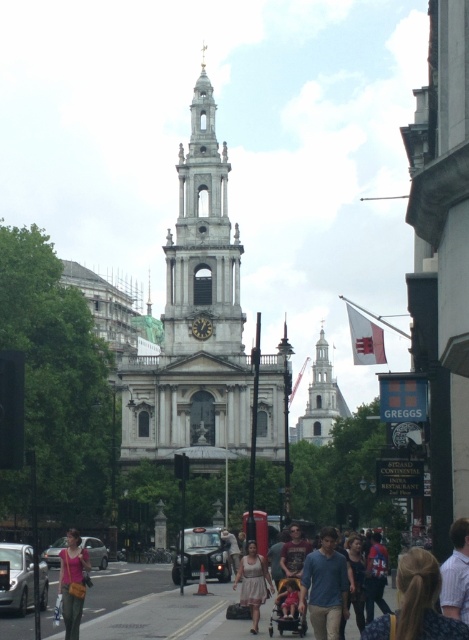
Locate an element on the screen. The height and width of the screenshot is (640, 469). black matte taxi at center is located at coordinates (205, 554).

Is black matte taxi at center above light brown leather jacket at center?

Actually, black matte taxi at center is below light brown leather jacket at center.

Is point (178, 572) closer to viewer compared to point (236, 570)?

Yes, point (178, 572) is closer to viewer.

The width and height of the screenshot is (469, 640). I want to click on black matte taxi at center, so coord(205,554).

Which is above, blue cotton shirt at center or pink fabric purse at lower left?

pink fabric purse at lower left is above.

Who is more distant from viewer, (337,611) or (78,621)?

The point (78,621) is behind.

The width and height of the screenshot is (469, 640). Identify the location of blue cotton shirt at center. (325, 586).

Is point (294, 598) more distant than point (51, 564)?

No.

Which is more to the right, dark gray plastic baby carriage at center or metallic silver car at lower left?

Positioned to the right is dark gray plastic baby carriage at center.

Who is more forward, (293,579) or (60,550)?

Point (293,579)

Find the location of a particular element. dark gray plastic baby carriage at center is located at coordinates [287, 609].